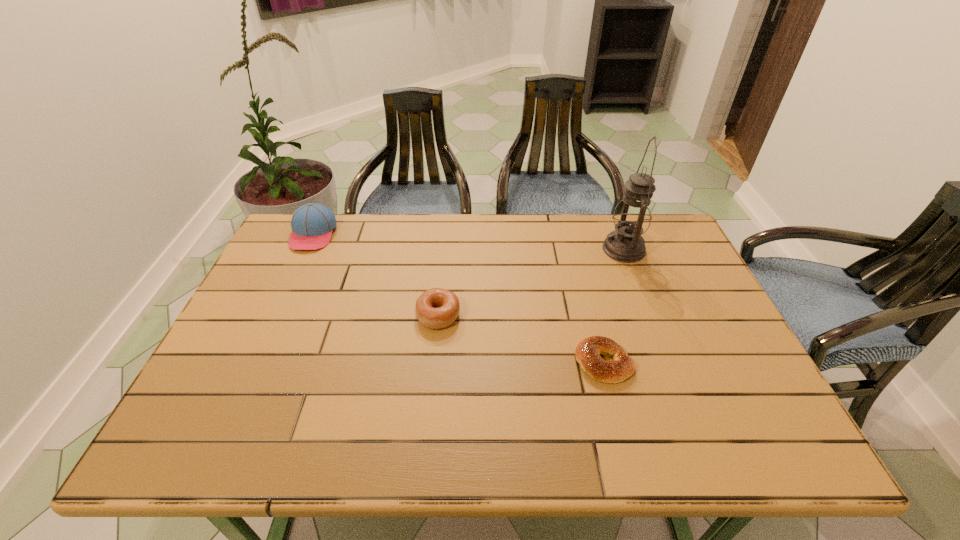
The height and width of the screenshot is (540, 960). I want to click on vacant space at the left edge, so click(257, 313).

Identify the location of vacant region at the right edge of the desktop. (713, 313).

In the image, there is a desktop. Where is `free space at the far right corner`? Image resolution: width=960 pixels, height=540 pixels. free space at the far right corner is located at coordinates (656, 232).

Locate an element on the screen. free space between the second object from right to left and the oil lamp is located at coordinates (613, 306).

This screenshot has height=540, width=960. In order to click on vacant space that's between the leftmost object and the tallest object in this screenshot , I will do `click(468, 241)`.

This screenshot has width=960, height=540. Identify the location of free space between the shorter bagel and the oil lamp. (613, 306).

Locate an element on the screen. This screenshot has width=960, height=540. empty space that is in between the baseball cap and the second object from right to left is located at coordinates (459, 298).

What are the coordinates of `unoccupied area between the taller bagel and the baseball cap` in the screenshot? It's located at (375, 274).

Where is `blank region between the third shortest object and the third object from left to right`? blank region between the third shortest object and the third object from left to right is located at coordinates pyautogui.click(x=459, y=298).

The height and width of the screenshot is (540, 960). I want to click on free spot between the rightmost object and the baseball cap, so click(468, 241).